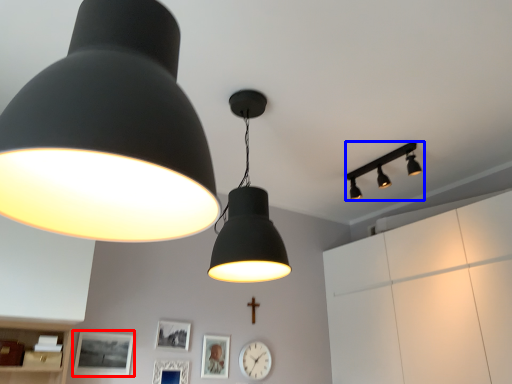
Question: Which of the following is the farthest to the observer, picture frame (highlighted by a red box) or lamp (highlighted by a blue box)?

Choices:
 (A) picture frame
 (B) lamp

Answer: (B)